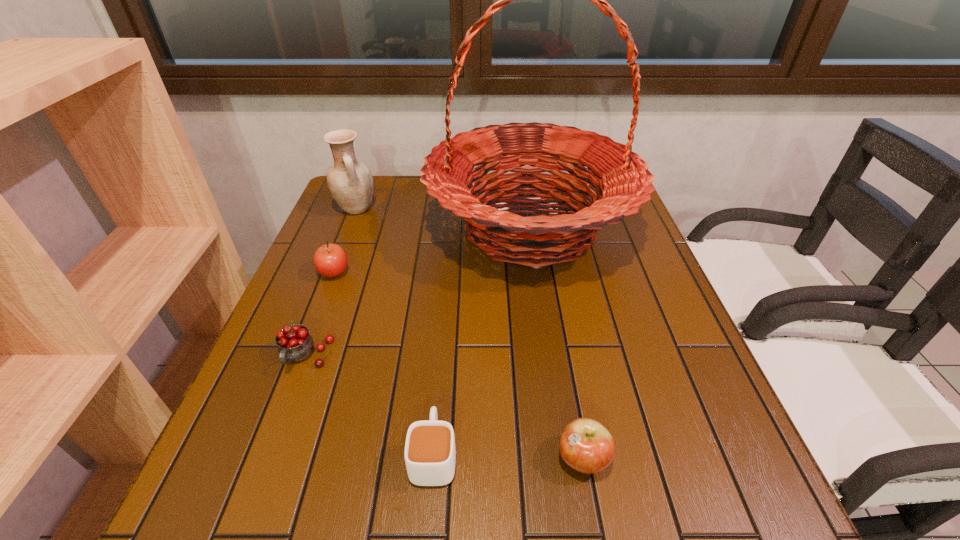
At what (x,y) coordinates should I click in order to perform the action: click on basket. Please return your answer as a coordinate pair (x, y). Looking at the image, I should click on (621, 178).

Image resolution: width=960 pixels, height=540 pixels. Find the location of `the second tallest object`. the second tallest object is located at coordinates (350, 183).

At what (x,y) coordinates should I click in order to perform the action: click on the farther apple. Please return your answer as a coordinate pair (x, y). Looking at the image, I should click on (330, 260).

This screenshot has height=540, width=960. In order to click on the taller apple in this screenshot , I will do `click(330, 260)`.

Where is `cherry`? cherry is located at coordinates (295, 343).

In order to click on the right apple in this screenshot , I will do click(585, 445).

Locate an element on the screen. The image size is (960, 540). the nearer apple is located at coordinates (585, 445).

At what (x,y) coordinates should I click in order to perform the action: click on cup. Please return your answer as a coordinate pair (x, y). Looking at the image, I should click on (430, 455).

Image resolution: width=960 pixels, height=540 pixels. Identify the location of vacant space located 0.320m on the front of the tallest object. (559, 425).

Identify the location of vacant point located 0.110m on the right of the second tallest object. (414, 209).